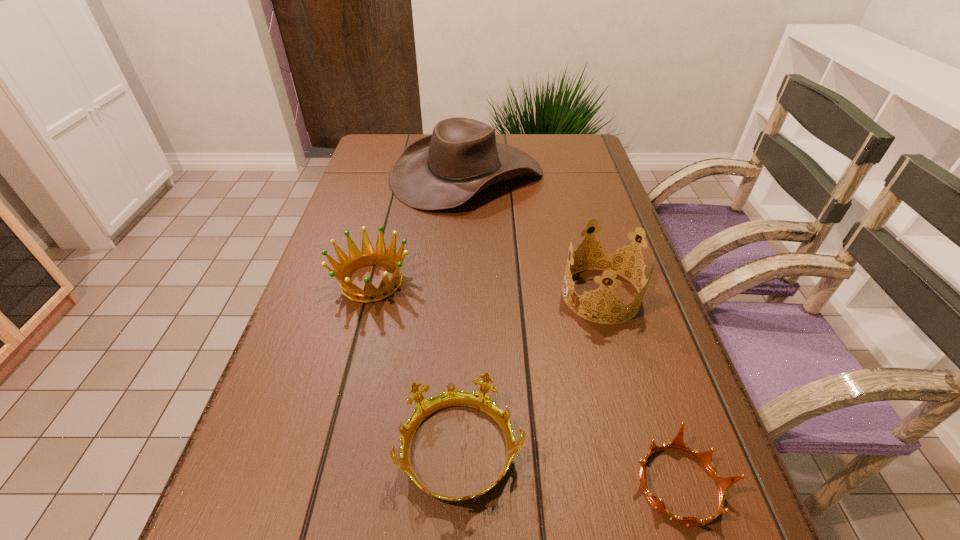
Locate an element on the screen. Image resolution: width=960 pixels, height=540 pixels. cowboy hat is located at coordinates (461, 157).

Find the location of a particular element. the tallest crown is located at coordinates (610, 261).

In order to click on the leftmost crown in this screenshot , I will do `click(356, 260)`.

This screenshot has width=960, height=540. What are the coordinates of `the second shortest object` in the screenshot? It's located at (480, 400).

The image size is (960, 540). I want to click on the second crown from left to right, so click(x=480, y=400).

Locate an element on the screen. Image resolution: width=960 pixels, height=540 pixels. the shortest object is located at coordinates (723, 484).

Locate an element on the screen. The width and height of the screenshot is (960, 540). free space located on the front of the cowboy hat is located at coordinates (464, 251).

The width and height of the screenshot is (960, 540). I want to click on vacant space situated on the front of the tallest crown, so click(x=626, y=383).

The image size is (960, 540). Identify the location of free space located 0.230m on the front of the leftmost crown. (338, 411).

Image resolution: width=960 pixels, height=540 pixels. I want to click on free space located 0.080m on the left of the second shortest crown, so click(x=348, y=451).